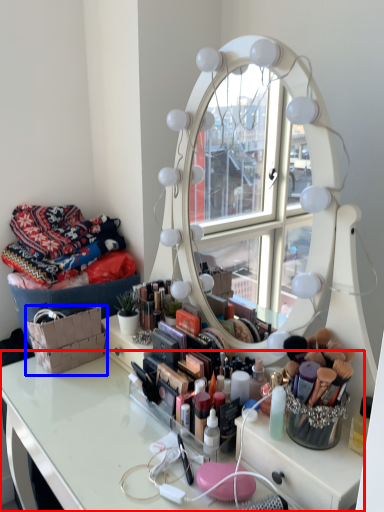
Question: Which point is further to the camera, table (highlighted by a red box) or basket (highlighted by a blue box)?

Choices:
 (A) table
 (B) basket

Answer: (B)